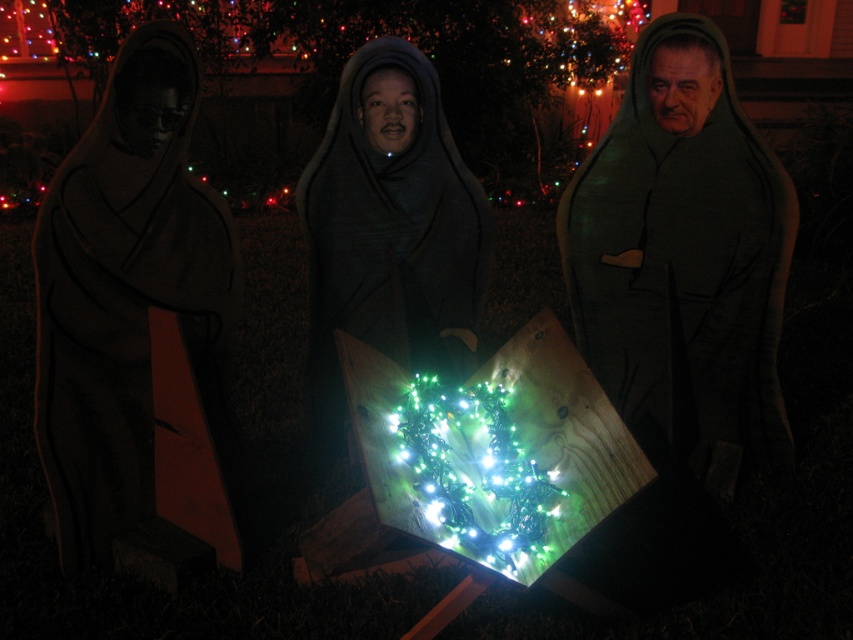
Between point (119, 180) and point (399, 38), which one is positioned in front?

Point (119, 180)

Where is `black matte robe at left`? black matte robe at left is located at coordinates (126, 298).

Is dark matte robe at center to the left of matte black robe at center from the viewer's perspective?

In fact, dark matte robe at center is to the right of matte black robe at center.

From the picture: Can you confirm if dark matte robe at center is smaller than matte black robe at center?

Incorrect, dark matte robe at center is not smaller in size than matte black robe at center.

Does point (688, 451) come in front of point (389, 209)?

No.

The height and width of the screenshot is (640, 853). I want to click on dark matte robe at center, so click(683, 250).

Which is below, black matte robe at left or green string lights at center?

green string lights at center is below.

The height and width of the screenshot is (640, 853). Describe the element at coordinates (126, 298) in the screenshot. I see `black matte robe at left` at that location.

Where is `black matte robe at left`? This screenshot has width=853, height=640. black matte robe at left is located at coordinates (126, 298).